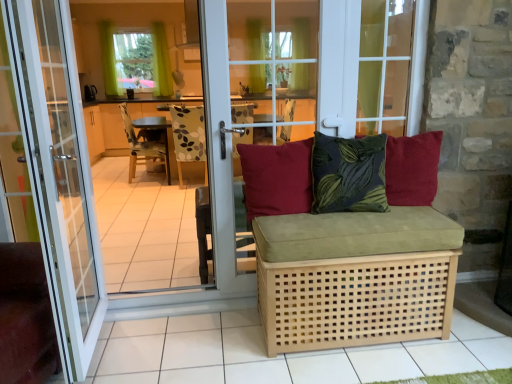
Question: Is transparent glass door at center bigger than wooden chair at center?

Choices:
 (A) no
 (B) yes

Answer: (A)

Question: Does transparent glass door at center have a lesser height compared to wooden chair at center?

Choices:
 (A) yes
 (B) no

Answer: (B)

Question: Is transparent glass door at center completely or partially outside of wooden chair at center?

Choices:
 (A) yes
 (B) no

Answer: (A)

Question: Considering the relative positions of transparent glass door at center and wooden chair at center in the image provided, is transparent glass door at center to the right of wooden chair at center from the viewer's perspective?

Choices:
 (A) yes
 (B) no

Answer: (A)

Question: Considering the relative positions of transparent glass door at center and wooden chair at center in the image provided, is transparent glass door at center behind wooden chair at center?

Choices:
 (A) no
 (B) yes

Answer: (A)

Question: Choose the correct answer: Is transparent glass door at center inside matte red cushion at center, the 1th pillow viewed from the left, or outside it?

Choices:
 (A) outside
 (B) inside

Answer: (A)

Question: Is transparent glass door at center wider or thinner than matte red cushion at center, the 1th pillow viewed from the left?

Choices:
 (A) thin
 (B) wide

Answer: (A)

Question: Is transparent glass door at center taller or shorter than matte red cushion at center, marked as the 3th pillow in a right-to-left arrangement?

Choices:
 (A) tall
 (B) short

Answer: (A)

Question: Looking at the image, does transparent glass door at center seem bigger or smaller compared to matte red cushion at center, marked as the 3th pillow in a right-to-left arrangement?

Choices:
 (A) small
 (B) big

Answer: (B)

Question: Does point (396, 91) appear closer or farther from the camera than point (430, 367)?

Choices:
 (A) farther
 (B) closer

Answer: (A)

Question: From a real-world perspective, is transparent glass door at center physically located above or below natural wood tile at lower center?

Choices:
 (A) above
 (B) below

Answer: (A)

Question: In terms of size, does transparent glass door at center appear bigger or smaller than natural wood tile at lower center?

Choices:
 (A) small
 (B) big

Answer: (B)

Question: Considering the relative positions of transparent glass door at center and natural wood tile at lower center in the image provided, is transparent glass door at center to the left or to the right of natural wood tile at lower center?

Choices:
 (A) left
 (B) right

Answer: (A)

Question: In terms of width, does natural wood tile at lower center look wider or thinner when compared to white glass door at center?

Choices:
 (A) thin
 (B) wide

Answer: (B)

Question: Visually, is natural wood tile at lower center positioned to the left or to the right of white glass door at center?

Choices:
 (A) left
 (B) right

Answer: (B)